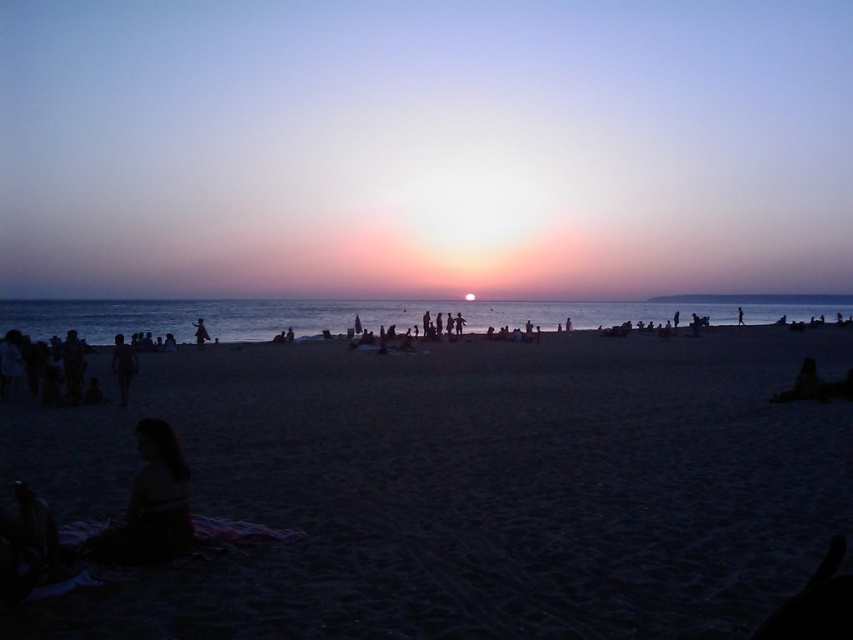
Question: Does silhouette human at center appear over silhouette figure at center?

Choices:
 (A) yes
 (B) no

Answer: (B)

Question: Does dark sand at center appear on the left side of silhouette human at center?

Choices:
 (A) no
 (B) yes

Answer: (A)

Question: Based on their relative distances, which object is farther from the silhouette figure at center?

Choices:
 (A) silhouette human at center
 (B) dark sand at center

Answer: (B)

Question: Which point appears closest to the camera in this image?

Choices:
 (A) (200, 323)
 (B) (96, 604)

Answer: (B)

Question: Considering the relative positions of dark sand at center and silhouette figure at center in the image provided, where is dark sand at center located with respect to silhouette figure at center?

Choices:
 (A) right
 (B) left

Answer: (A)

Question: Among these objects, which one is farthest from the camera?

Choices:
 (A) silhouette figure at center
 (B) dark sand at center

Answer: (A)